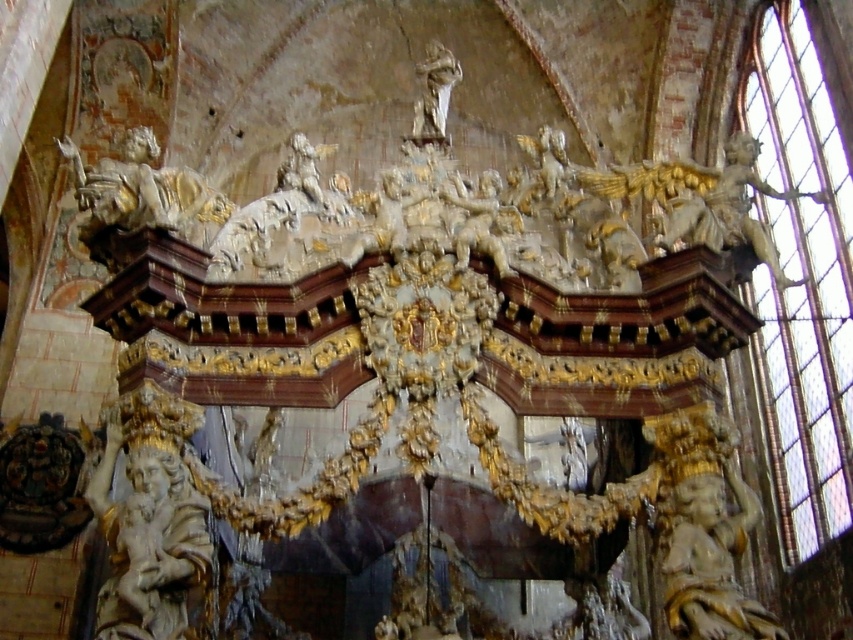
Does gold leaf statue at upper left come behind gold leaf statue at right?

That is False.

Locate an element on the screen. The image size is (853, 640). gold leaf statue at upper left is located at coordinates (143, 192).

The height and width of the screenshot is (640, 853). In order to click on gold leaf statue at upper left in this screenshot , I will do `click(143, 192)`.

Does polished stone cherub at left appear on the right side of white marble cherub at upper center?

In fact, polished stone cherub at left is to the left of white marble cherub at upper center.

Between polished stone cherub at left and white marble cherub at upper center, which one appears on the left side from the viewer's perspective?

polished stone cherub at left is more to the left.

Does point (144, 502) come behind point (422, 64)?

No.

Where is `polished stone cherub at left`? The height and width of the screenshot is (640, 853). polished stone cherub at left is located at coordinates (151, 532).

The height and width of the screenshot is (640, 853). Describe the element at coordinates (143, 192) in the screenshot. I see `gold leaf statue at upper left` at that location.

Is gold leaf statue at upper left positioned in front of white marble cherub at upper center?

Yes.

Is point (82, 228) positioned in front of point (448, 93)?

Yes, point (82, 228) is closer to viewer.

At what (x,y) coordinates should I click in order to perform the action: click on gold leaf statue at upper left. Please return your answer as a coordinate pair (x, y). The image size is (853, 640). Looking at the image, I should click on (143, 192).